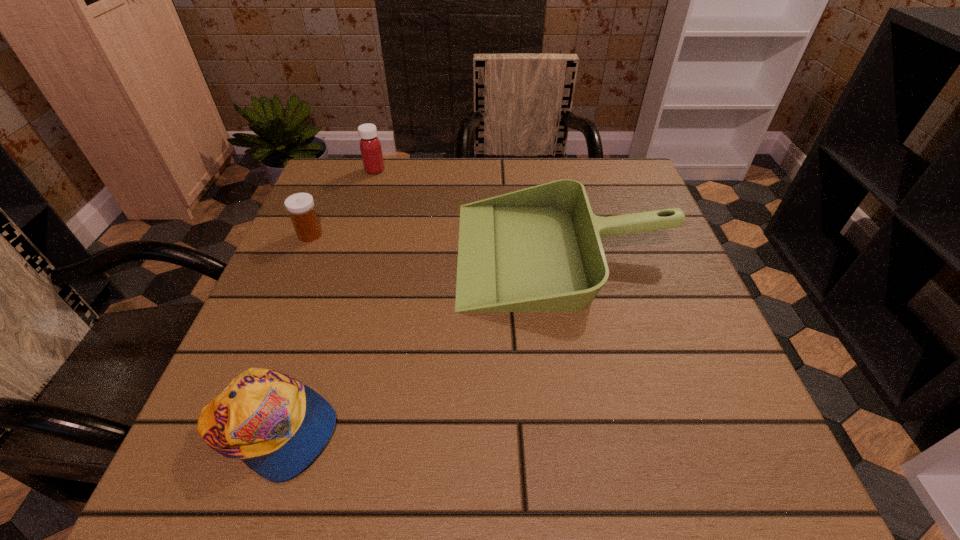
Find the location of a particular element. The width and height of the screenshot is (960, 540). the farther medicine is located at coordinates (370, 146).

You are a GUI agent. You are given a task and a screenshot of the screen. Output one action in this format:
    pyautogui.click(x=<x>, y=<y>)
    Task: Click on the right medicine
    The image size is (960, 540).
    Given the screenshot: What is the action you would take?
    pyautogui.click(x=370, y=146)

Where is `dustpan`? This screenshot has height=540, width=960. dustpan is located at coordinates (539, 249).

The height and width of the screenshot is (540, 960). Identify the location of the nearer medicine. (300, 206).

At what (x,y) coordinates should I click in order to perform the action: click on the shorter medicine. Please return your answer as a coordinate pair (x, y). Image resolution: width=960 pixels, height=540 pixels. Looking at the image, I should click on (300, 206).

The width and height of the screenshot is (960, 540). Identify the location of cap. (276, 425).

This screenshot has width=960, height=540. Identify the location of vacant area located 0.280m on the right of the right medicine. (492, 170).

Locate an element on the screen. The width and height of the screenshot is (960, 540). vacant space situated 0.220m on the scoop of the dustpan is located at coordinates (353, 252).

Where is `vacant space located 0.310m on the scoop of the dustpan`? Image resolution: width=960 pixels, height=540 pixels. vacant space located 0.310m on the scoop of the dustpan is located at coordinates tap(310, 252).

Locate an element on the screen. This screenshot has height=540, width=960. vacant space located on the scoop of the dustpan is located at coordinates (396, 252).